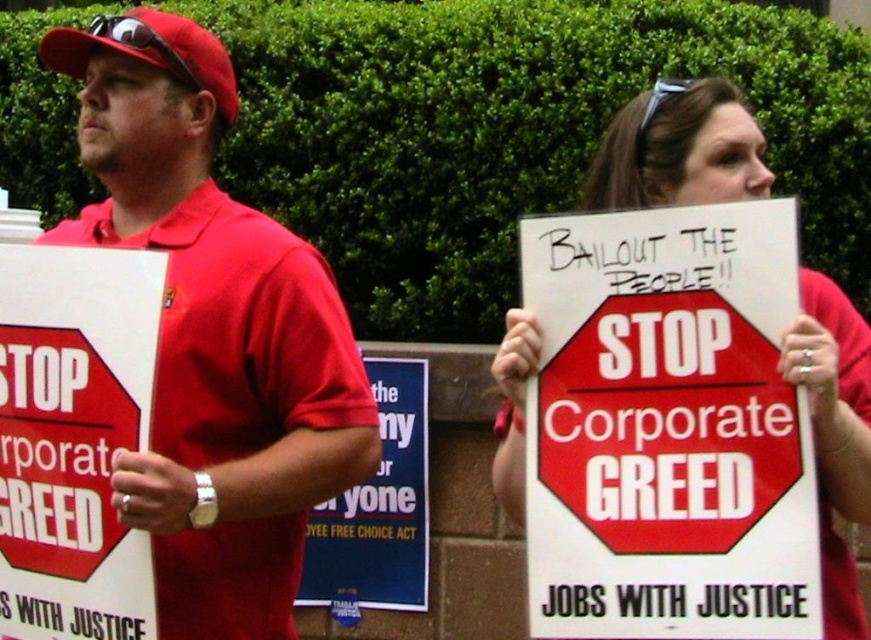
Between matte red shirt at left and matte red stop sign at left, which one is positioned higher?

matte red shirt at left

Does matte red shirt at left have a lesser width compared to matte red stop sign at left?

Incorrect, matte red shirt at left's width is not less than matte red stop sign at left's.

The image size is (871, 640). In order to click on matte red shirt at left in this screenshot , I will do `click(214, 333)`.

Find the location of a particular element. matte red shirt at left is located at coordinates (214, 333).

Which of these two, matte white sign at center or white paper sign at center, stands shorter?

With less height is matte white sign at center.

This screenshot has height=640, width=871. Describe the element at coordinates (679, 148) in the screenshot. I see `matte white sign at center` at that location.

Find the location of a particular element. matte white sign at center is located at coordinates (679, 148).

Between white paper sign at center and matte red baseball cap at upper left, which one is positioned higher?

matte red baseball cap at upper left

This screenshot has width=871, height=640. Describe the element at coordinates (377, 508) in the screenshot. I see `white paper sign at center` at that location.

The image size is (871, 640). I want to click on white paper sign at center, so click(377, 508).